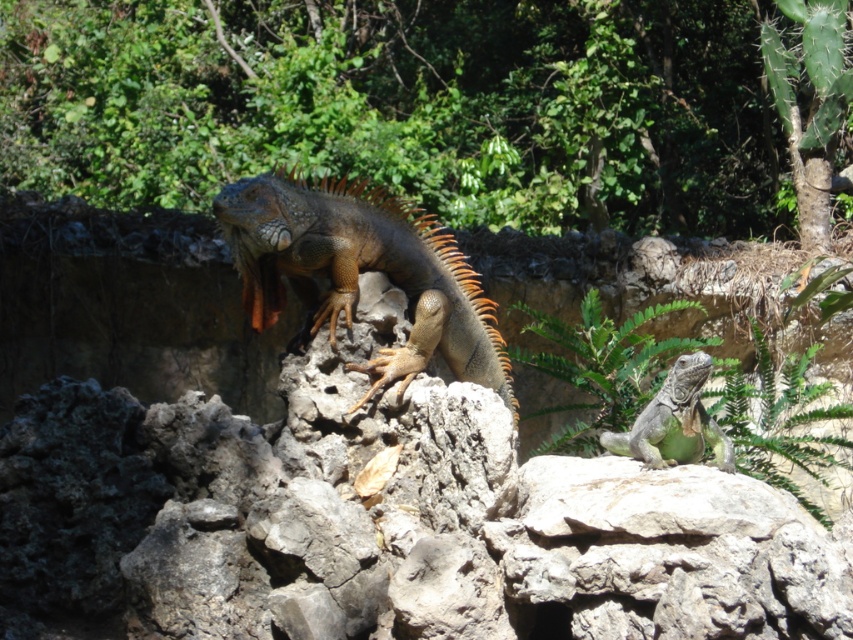
Does shiny brown iguana at center appear over green scaly lizard at center?

Indeed, shiny brown iguana at center is positioned over green scaly lizard at center.

Looking at this image, can you confirm if shiny brown iguana at center is taller than green scaly lizard at center?

Correct, shiny brown iguana at center is much taller as green scaly lizard at center.

Is point (386, 204) farther from viewer compared to point (693, 417)?

That is True.

Locate an element on the screen. The height and width of the screenshot is (640, 853). shiny brown iguana at center is located at coordinates (361, 269).